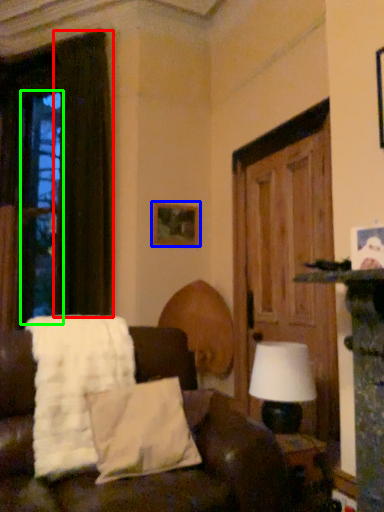
Question: Which is nearer to the curtain (highlighted by a red box)? picture frame (highlighted by a blue box) or window (highlighted by a green box).

Choices:
 (A) picture frame
 (B) window

Answer: (A)